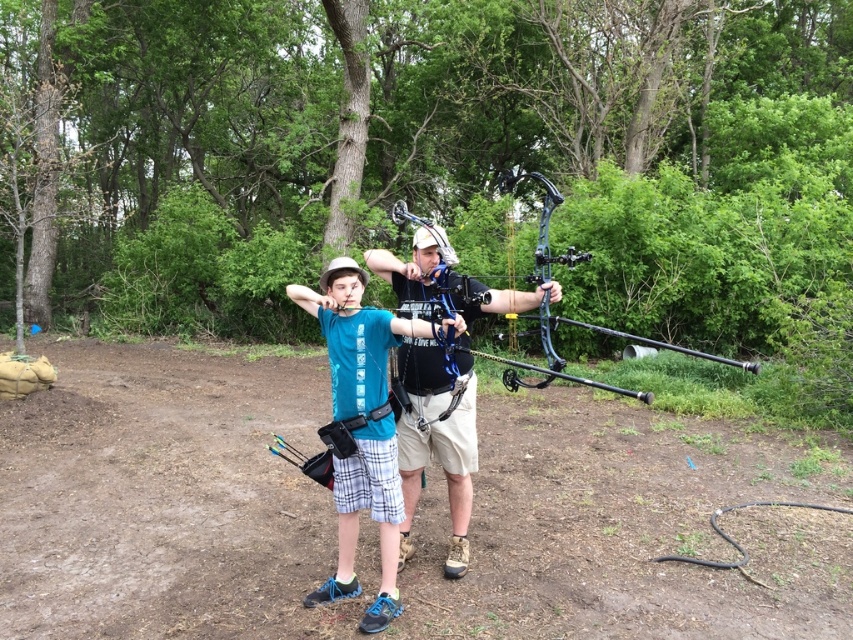
Question: Which object is the farthest from the matte black fishing pole at center?

Choices:
 (A) matte black bow at center
 (B) shiny black bow at center
 (C) blue fabric shirt at center

Answer: (C)

Question: Considering the real-world distances, which object is closest to the blue fabric shirt at center?

Choices:
 (A) matte black bow at center
 (B) shiny black bow at center
 (C) matte black fishing pole at center

Answer: (A)

Question: Does blue fabric shirt at center come behind shiny black bow at center?

Choices:
 (A) yes
 (B) no

Answer: (A)

Question: Which object is farther from the camera taking this photo?

Choices:
 (A) matte black fishing pole at center
 (B) shiny black bow at center
 (C) matte black bow at center

Answer: (C)

Question: Where is blue fabric shirt at center located in relation to matte black fishing pole at center in the image?

Choices:
 (A) left
 (B) right

Answer: (A)

Question: Is blue fabric shirt at center above shiny black bow at center?

Choices:
 (A) no
 (B) yes

Answer: (A)